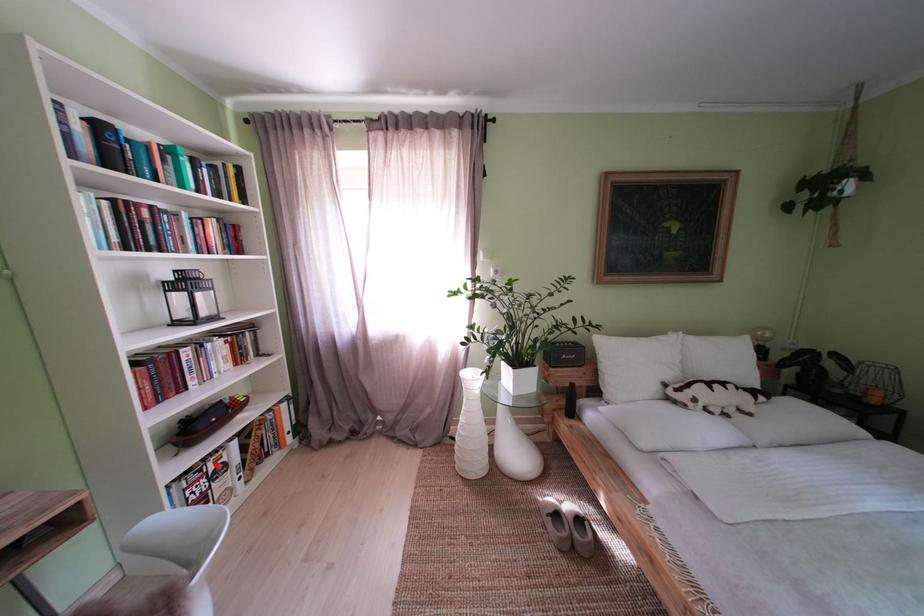
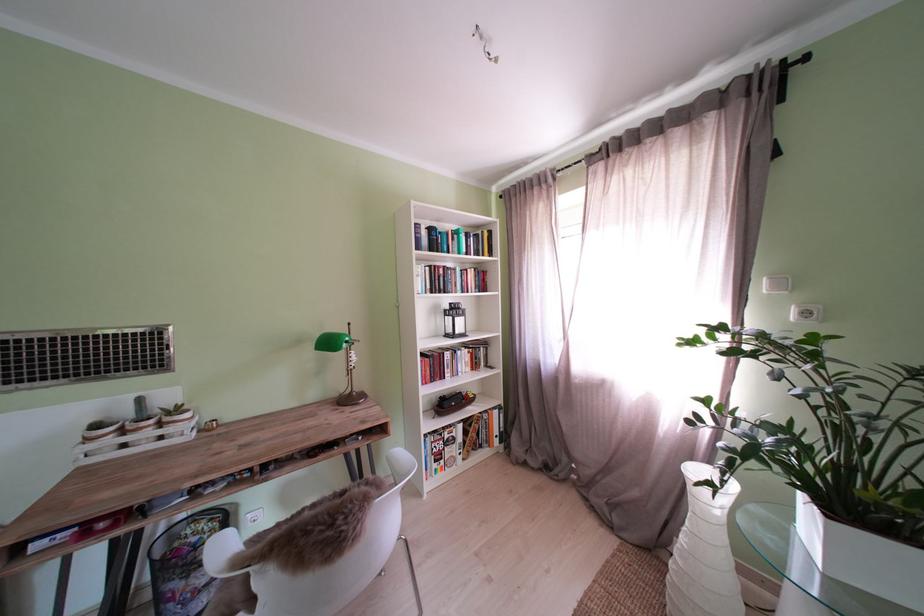
Question: A red point is marked in image1. In image2, is the corresponding 3D point closer to the camera or farther? Reply with the corresponding letter.

Choices:
 (A) The corresponding 3D point is closer.
 (B) The corresponding 3D point is farther.

Answer: (B)